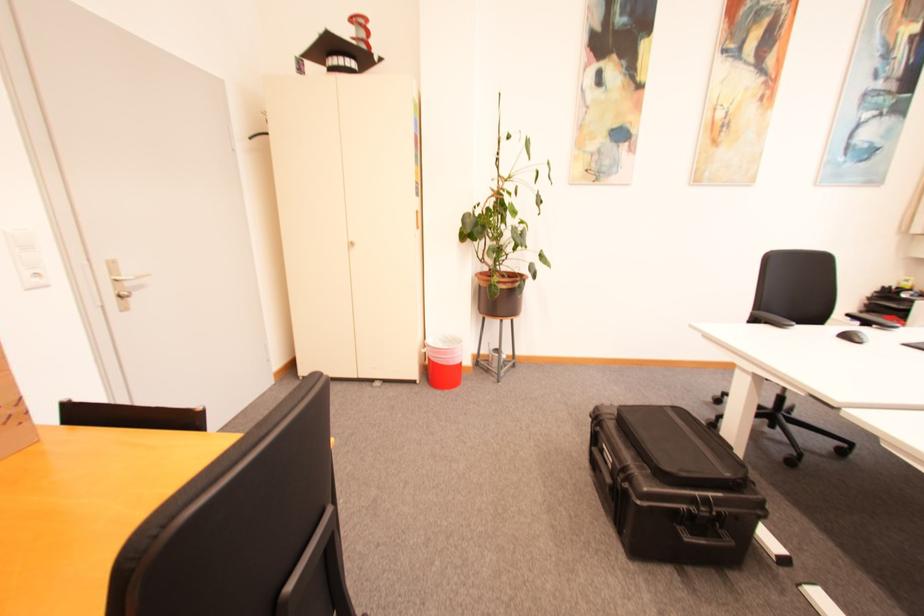
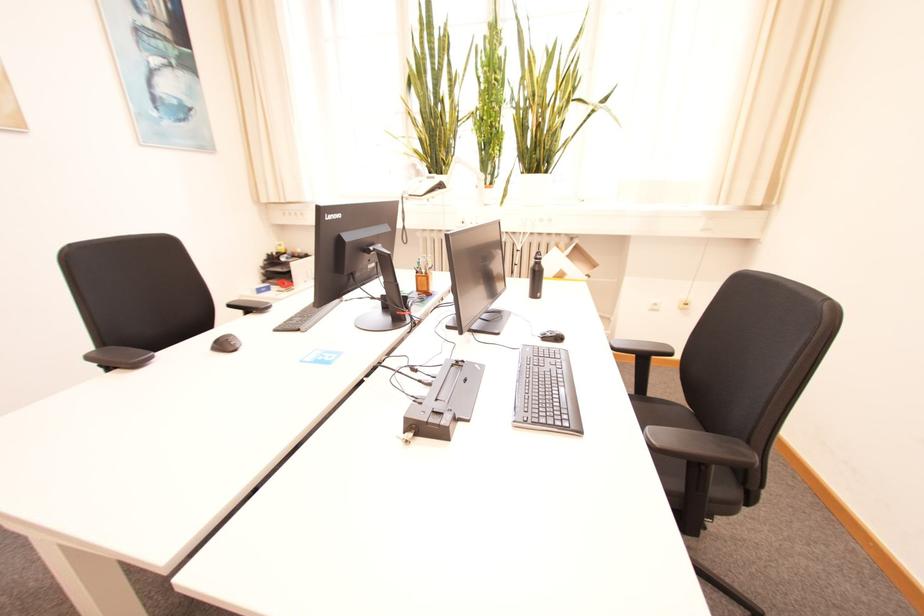
Find the pixel in the second image that matches (x=855, y=339) in the first image.

(229, 346)